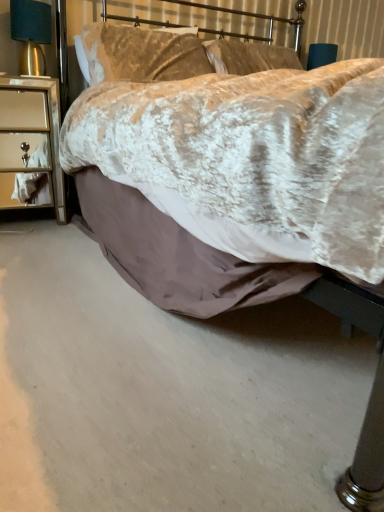
Question: Is satin gold lampshade at left bigger or smaller than velvet beige pillow at upper center?

Choices:
 (A) big
 (B) small

Answer: (B)

Question: In terms of height, does satin gold lampshade at left look taller or shorter compared to velvet beige pillow at upper center?

Choices:
 (A) tall
 (B) short

Answer: (B)

Question: Which object is the closest to the silver mirrored nightstand at left?

Choices:
 (A) velvet beige pillow at upper center
 (B) satin gold lampshade at left

Answer: (B)

Question: Which object is the closest to the velvet beige pillow at upper center?

Choices:
 (A) silver mirrored nightstand at left
 (B) satin gold lampshade at left

Answer: (B)